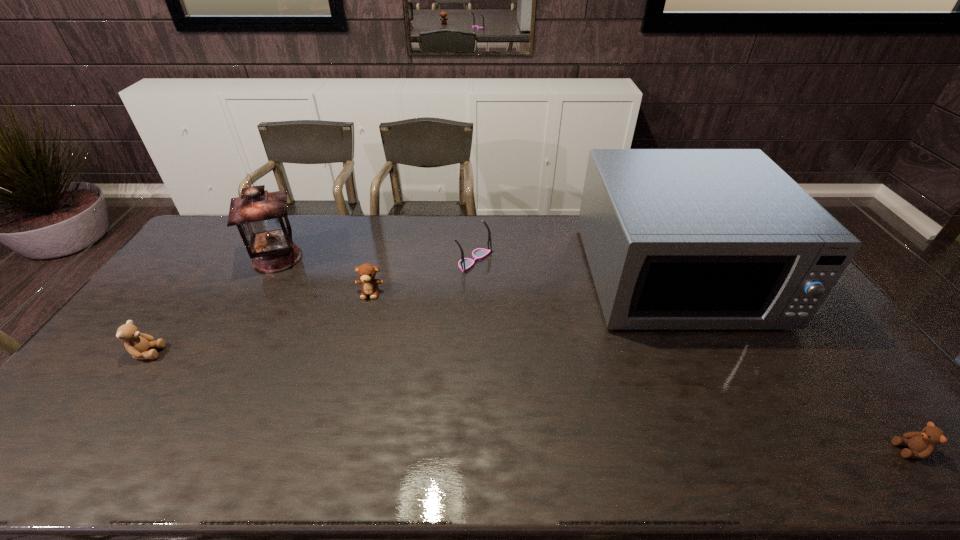
In order to click on vacant space situated on the right of the oil lamp in this screenshot , I will do `click(385, 258)`.

Locate an element on the screen. This screenshot has width=960, height=540. vacant region located 0.340m on the front of the third object from right to left is located at coordinates (473, 352).

You are a GUI agent. You are given a task and a screenshot of the screen. Output one action in this format:
    pyautogui.click(x=<x>, y=<y>)
    Task: Click on the vacant area situated on the face of the second teddy bear from left to right
    This screenshot has height=540, width=960.
    Given the screenshot: What is the action you would take?
    pyautogui.click(x=356, y=346)

Where is `vacant space located on the front-facing side of the leftmost teddy bear`? vacant space located on the front-facing side of the leftmost teddy bear is located at coordinates (251, 353).

At what (x,y) coordinates should I click in order to perform the action: click on vacant space situated 0.050m on the face of the nearest teddy bear. Please return your answer as a coordinate pair (x, y). The image size is (960, 540). Looking at the image, I should click on (875, 450).

Image resolution: width=960 pixels, height=540 pixels. Find the location of `vacant area located 0.240m on the face of the nearest teddy bear`. vacant area located 0.240m on the face of the nearest teddy bear is located at coordinates (793, 450).

You are a GUI agent. You are given a task and a screenshot of the screen. Output one action in this format:
    pyautogui.click(x=<x>, y=<y>)
    Task: Click on the free region located 0.090m on the face of the nearest teddy bear
    This screenshot has width=960, height=540.
    Given the screenshot: What is the action you would take?
    pyautogui.click(x=857, y=450)

At what (x,y) coordinates should I click in order to perform the action: click on microwave oven that is at the far edge. Please return your answer as a coordinate pair (x, y). Looking at the image, I should click on (675, 238).

You are a GUI agent. You are given a task and a screenshot of the screen. Output one action in this format:
    pyautogui.click(x=<x>, y=<y>)
    Task: Click on the oil lamp located at the far edge
    
    Given the screenshot: What is the action you would take?
    pyautogui.click(x=261, y=217)

You are a GUI agent. You are given a task and a screenshot of the screen. Output one action in this format:
    pyautogui.click(x=<x>, y=<y>)
    Task: Click on the spectacles that is at the far edge
    
    Given the screenshot: What is the action you would take?
    pyautogui.click(x=464, y=264)